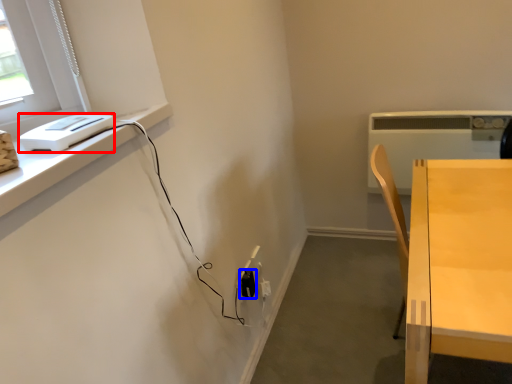
Question: Which of the following is the closest to the observer, appliance (highlighted by a red box) or electric outlet (highlighted by a blue box)?

Choices:
 (A) appliance
 (B) electric outlet

Answer: (A)